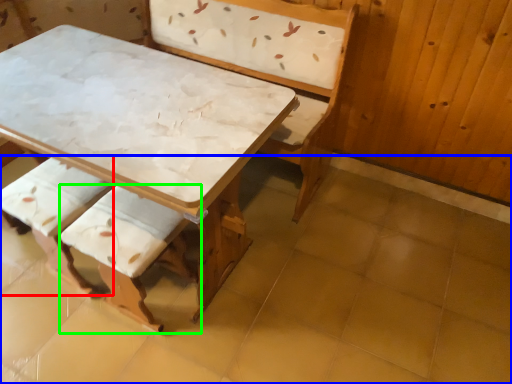
Question: Based on their relative distances, which object is nearer to armchair (highlighted by a red box)? Choose from tile (highlighted by a blue box) and armchair (highlighted by a green box).

Choices:
 (A) tile
 (B) armchair

Answer: (B)